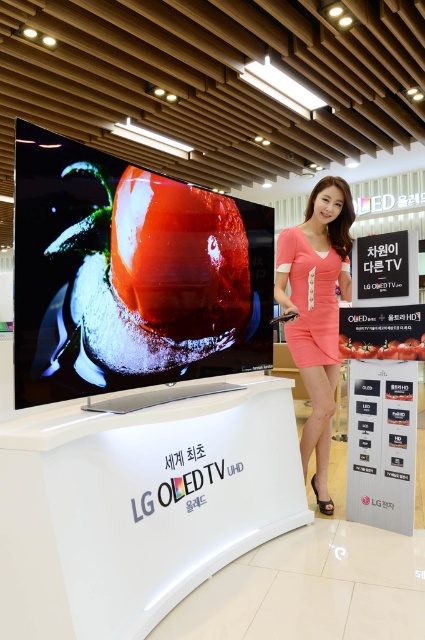
You are a customer in the store looking at the LG OLED TV display. You notice two dresses at the center of the display. Which dress is closer to you, the pink fabric dress at center or the pink satin dress at center?

The pink fabric dress at center is closer to you because it is in front of the pink satin dress at center.